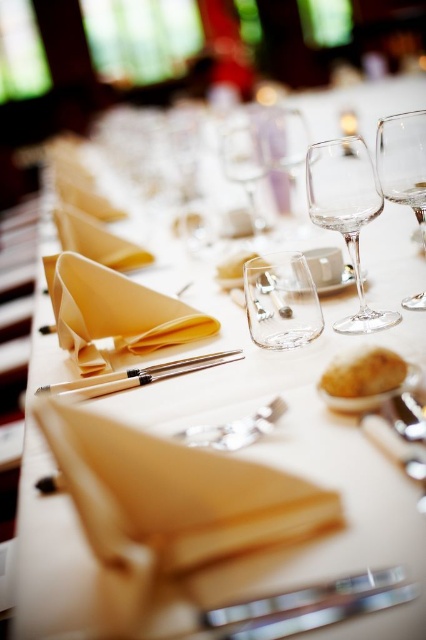
You are a photographer holding a camera and want to capture a closeup shot of the transparent glass wine glass at upper right without any obstructions. Based on the scene description, can you confirm if you are within the recommended 24 inches distance for a detailed closeup? Please explain your reasoning.

The transparent glass wine glass at upper right and the camera are 24.36 inches apart. Since the recommended distance for a detailed closeup is 24 inches, you are slightly beyond the optimal range by 0.36 inches. To achieve the best results, move the camera 0.36 inches closer to the glass.

You are a server at a formal dinner. You need to place a small note card between the transparent glass wine glass at upper right and the wooden chopsticks at center. Which object should you place the note card closer to if you want it to be more visible to guests seated at the table?

You should place the note card closer to the transparent glass wine glass at upper right because it is much taller than the wooden chopsticks at center, making it a better reference point for visibility.